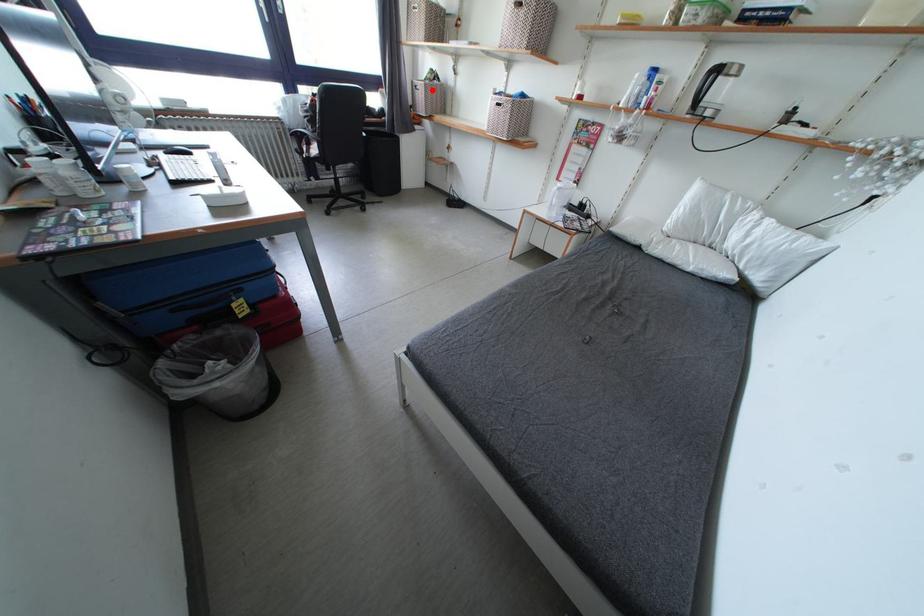
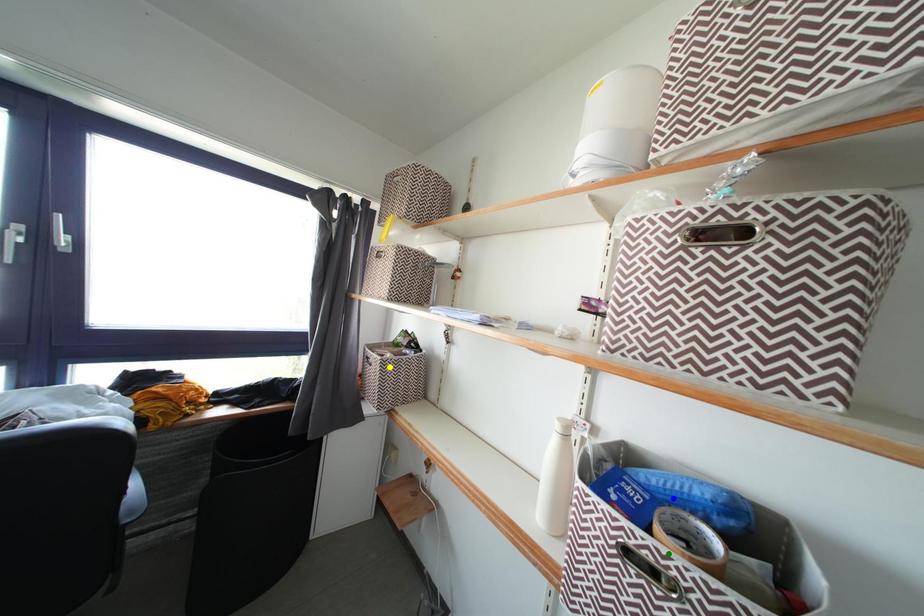
Question: I am providing you with two images of the same scene from different viewpoints. A red point is marked on the first image. You are given multiple points on the second image. Which point in image 2 is actually the same real-world point as the red point in image 1?

Choices:
 (A) green point
 (B) yellow point
 (C) blue point

Answer: (B)